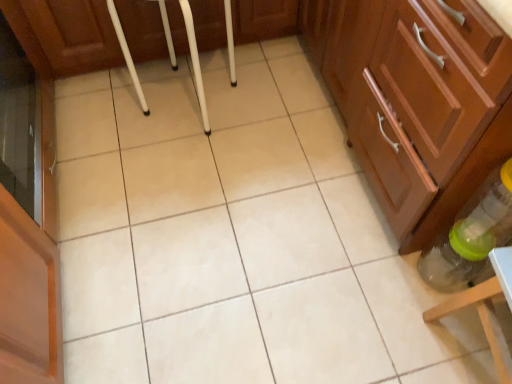
Question: Considering the relative sizes of matte wood cabinet at center-right, which ranks as the second cabinetry in top-to-bottom order, and wooden cabinet at center, which appears as the second cabinetry when ordered from the bottom, in the image provided, is matte wood cabinet at center-right, which ranks as the second cabinetry in top-to-bottom order, wider than wooden cabinet at center, which appears as the second cabinetry when ordered from the bottom,?

Choices:
 (A) no
 (B) yes

Answer: (B)

Question: Are matte wood cabinet at center-right, which ranks as the second cabinetry in top-to-bottom order, and wooden cabinet at center, which appears as the second cabinetry when ordered from the bottom, far apart?

Choices:
 (A) yes
 (B) no

Answer: (B)

Question: Is matte wood cabinet at center-right, which ranks as the second cabinetry in top-to-bottom order, facing away from wooden cabinet at center, which appears as the second cabinetry when ordered from the bottom?

Choices:
 (A) yes
 (B) no

Answer: (B)

Question: From a real-world perspective, is matte wood cabinet at center-right, which ranks as the second cabinetry in top-to-bottom order, beneath wooden cabinet at center, arranged as the first cabinetry when viewed from the top?

Choices:
 (A) no
 (B) yes

Answer: (B)

Question: Considering the relative positions of matte wood cabinet at center-right, which ranks as the second cabinetry in top-to-bottom order, and wooden cabinet at center, which appears as the second cabinetry when ordered from the bottom, in the image provided, is matte wood cabinet at center-right, which ranks as the second cabinetry in top-to-bottom order, behind wooden cabinet at center, which appears as the second cabinetry when ordered from the bottom,?

Choices:
 (A) yes
 (B) no

Answer: (B)

Question: Considering the relative sizes of matte wood cabinet at center-right, which ranks as the second cabinetry in top-to-bottom order, and wooden cabinet at center, arranged as the first cabinetry when viewed from the top, in the image provided, is matte wood cabinet at center-right, which ranks as the second cabinetry in top-to-bottom order, thinner than wooden cabinet at center, arranged as the first cabinetry when viewed from the top,?

Choices:
 (A) no
 (B) yes

Answer: (A)

Question: Is white plastic bar stool at center surrounded by wooden cabinet at center, which appears as the second cabinetry when ordered from the bottom?

Choices:
 (A) yes
 (B) no

Answer: (B)

Question: Can you confirm if wooden cabinet at center, which appears as the second cabinetry when ordered from the bottom, is thinner than white plastic bar stool at center?

Choices:
 (A) no
 (B) yes

Answer: (A)

Question: From the image's perspective, is wooden cabinet at center, which appears as the second cabinetry when ordered from the bottom, beneath white plastic bar stool at center?

Choices:
 (A) yes
 (B) no

Answer: (B)

Question: Is the depth of wooden cabinet at center, which appears as the second cabinetry when ordered from the bottom, less than that of white plastic bar stool at center?

Choices:
 (A) yes
 (B) no

Answer: (B)

Question: Considering the relative sizes of wooden cabinet at center, arranged as the first cabinetry when viewed from the top, and white plastic bar stool at center in the image provided, is wooden cabinet at center, arranged as the first cabinetry when viewed from the top, wider than white plastic bar stool at center?

Choices:
 (A) no
 (B) yes

Answer: (B)

Question: Is wooden cabinet at center, which appears as the second cabinetry when ordered from the bottom, further to the viewer compared to white plastic bar stool at center?

Choices:
 (A) yes
 (B) no

Answer: (A)

Question: Is matte wood cabinet at center-right, which ranks as the second cabinetry in top-to-bottom order, facing away from translucent plastic bottle at lower right?

Choices:
 (A) yes
 (B) no

Answer: (B)